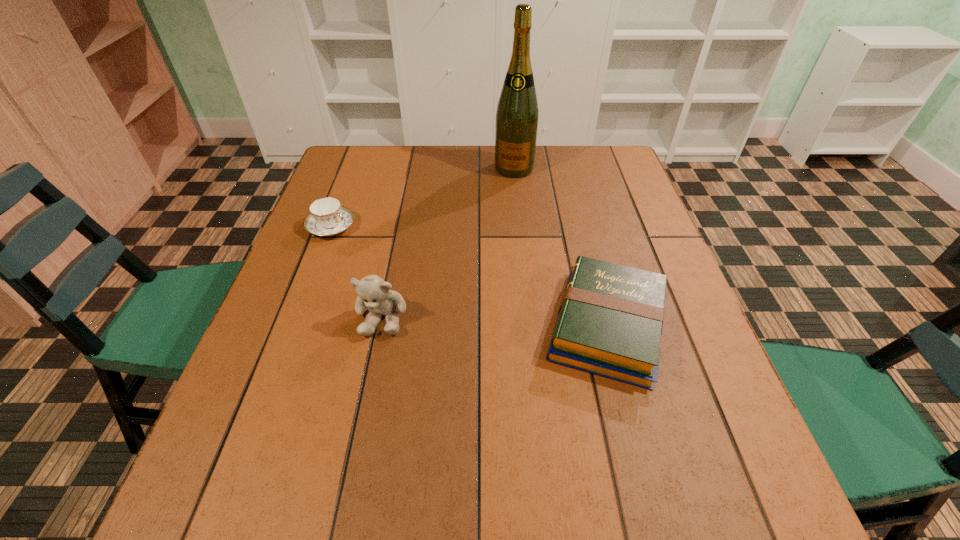
The height and width of the screenshot is (540, 960). Identify the location of free point located on the front-facing side of the wine bottle. (509, 192).

Locate an element on the screen. The width and height of the screenshot is (960, 540). vacant space located on the front-facing side of the wine bottle is located at coordinates (509, 192).

Where is `vacant space situated on the side with the handle of the teacup`? The width and height of the screenshot is (960, 540). vacant space situated on the side with the handle of the teacup is located at coordinates (404, 265).

Identify the location of vacant space located on the side with the handle of the teacup. (392, 258).

You are a GUI agent. You are given a task and a screenshot of the screen. Output one action in this format:
    pyautogui.click(x=<x>, y=<y>)
    Task: Click on the free space located on the side with the handle of the teacup
    
    Given the screenshot: What is the action you would take?
    pyautogui.click(x=376, y=250)

At what (x,y) coordinates should I click in order to perform the action: click on object situated at the far edge. Please return your answer as a coordinate pair (x, y). Looking at the image, I should click on (517, 115).

The width and height of the screenshot is (960, 540). Find the location of `object positioned at the left edge`. object positioned at the left edge is located at coordinates (327, 217).

Identify the location of object at the right edge. (609, 323).

Identify the location of vacant space at the far edge of the desktop. (543, 171).

In the image, there is a desktop. At what (x,y) coordinates should I click in order to perform the action: click on vacant space at the near edge. Please return your answer as a coordinate pair (x, y). Looking at the image, I should click on (495, 412).